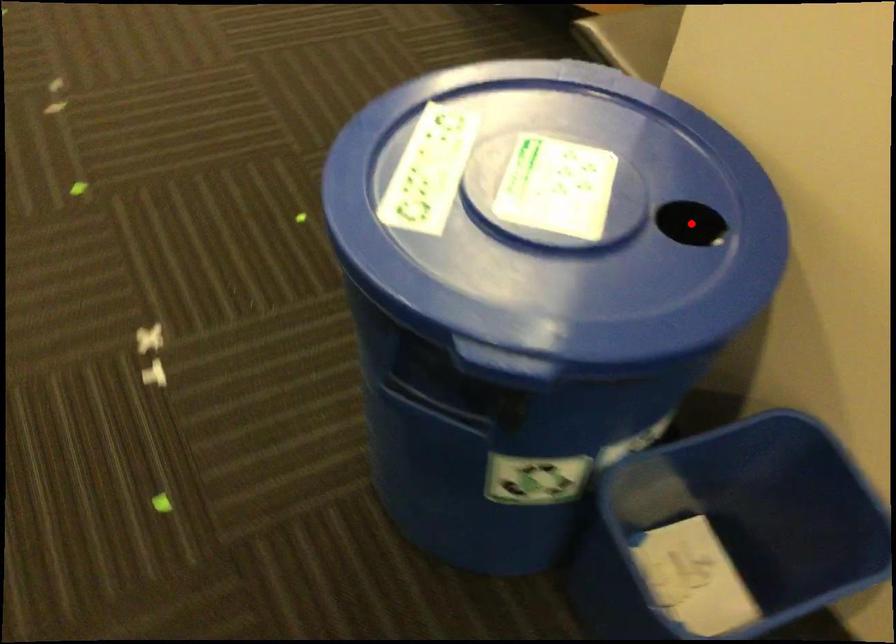
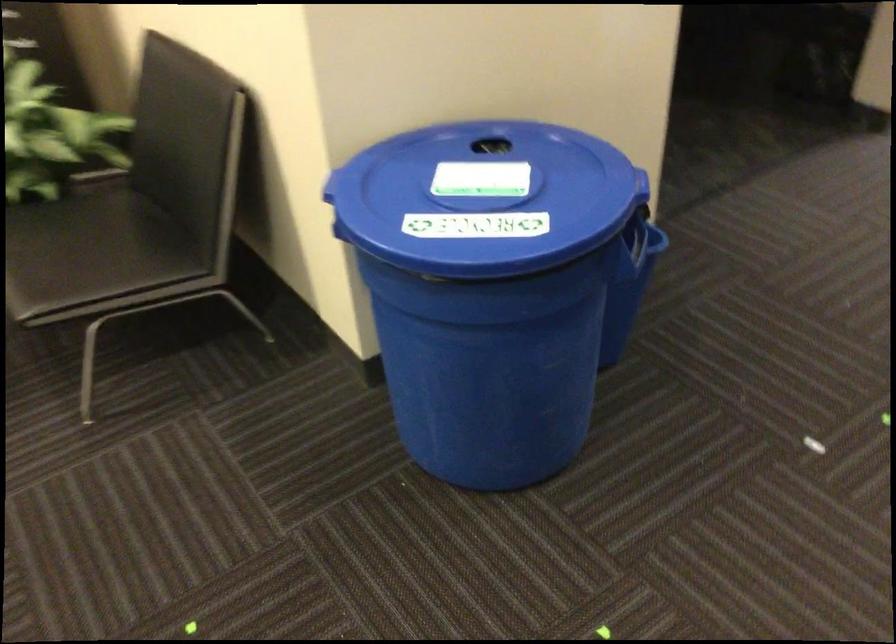
Question: I am providing you with two images of the same scene from different viewpoints. A red point is marked on the first image. Can you still see the location of the red point in image 2?

Choices:
 (A) Yes
 (B) No

Answer: (B)